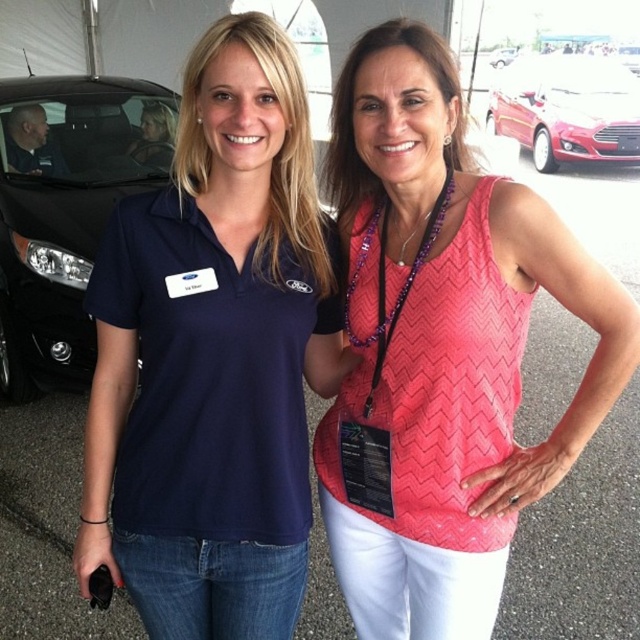
You are a photographer at the car dealership event and need to position two markers for a photo shoot. The first marker should be placed at point (449, 449) and the second at point (508, 52). From the photographer standing at the front of the tent, which marker is closer to the camera?

Point (449, 449) is in front of point (508, 52), so the first marker at point (449, 449) is closer to the camera.

You are at a car dealership event and see two women under a tent. The first woman is wearing a navy blue polo shirt with a Ford logo, and the second woman has a sleeveless pink top with a zigzag pattern. A point labeled on the image is at coordinates (445, 346). Which woman is wearing the clothing item that the point refers to?

The point labeled at coordinates (445, 346) refers to the pink chevron tank top at center, so the second woman with the sleeveless pink top is wearing the clothing item indicated by the point.